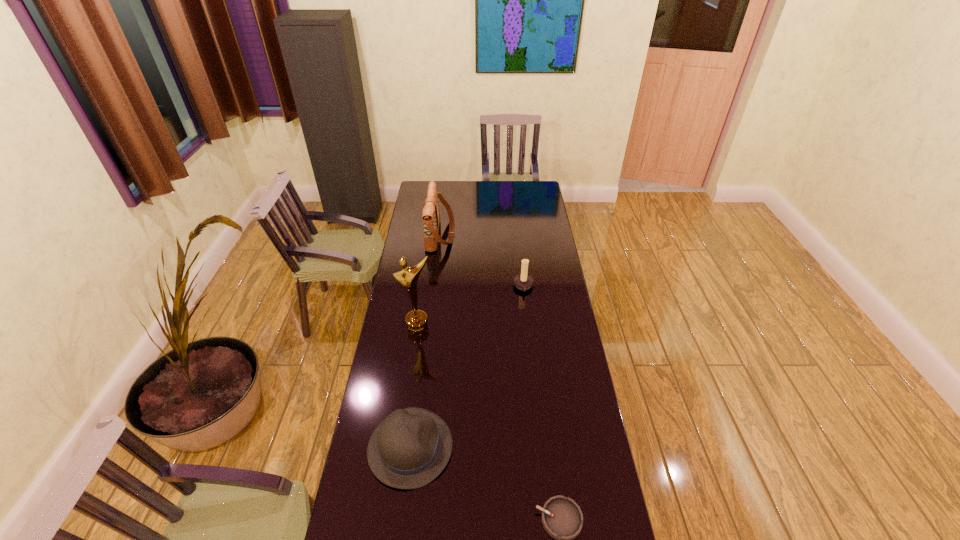
I want to click on vacant area between the farthest object and the fourth farthest object, so click(425, 341).

Locate an element on the screen. vacant area that lies between the candle holder and the bowler hat is located at coordinates (467, 367).

You are a GUI agent. You are given a task and a screenshot of the screen. Output one action in this format:
    pyautogui.click(x=<x>, y=<y>)
    Task: Click on the free space between the farthest object and the award
    Image resolution: width=960 pixels, height=540 pixels.
    Given the screenshot: What is the action you would take?
    pyautogui.click(x=429, y=280)

The height and width of the screenshot is (540, 960). Find the location of `vacant space in between the third farthest object and the fourth shortest object`. vacant space in between the third farthest object and the fourth shortest object is located at coordinates (429, 280).

You are a GUI agent. You are given a task and a screenshot of the screen. Output one action in this format:
    pyautogui.click(x=<x>, y=<y>)
    Task: Click on the vacant space that is in between the fourth farthest object and the second tallest object
    The width and height of the screenshot is (960, 540).
    Given the screenshot: What is the action you would take?
    pyautogui.click(x=425, y=341)

Locate an element on the screen. free space between the bowler hat and the shoulder bag is located at coordinates (425, 341).

At what (x,y) coordinates should I click in order to perform the action: click on vacant point located between the second nearest object and the candle holder. Please return your answer as a coordinate pair (x, y). The height and width of the screenshot is (540, 960). Looking at the image, I should click on (467, 367).

Locate an element on the screen. The width and height of the screenshot is (960, 540). object that stands as the closest to the farthest object is located at coordinates (522, 281).

Select which object appears as the second closest to the bowler hat. Please provide its 2D coordinates. Your answer should be formatted as a tuple, i.e. [(x, y)], where the tuple contains the x and y coordinates of a point satisfying the conditions above.

[(416, 321)]

Locate an element on the screen. Image resolution: width=960 pixels, height=540 pixels. blank area in the image that satisfies the following two spatial constraints: 1. on the wick of the second farthest object; 2. on the front-facing side of the tallest object is located at coordinates (528, 327).